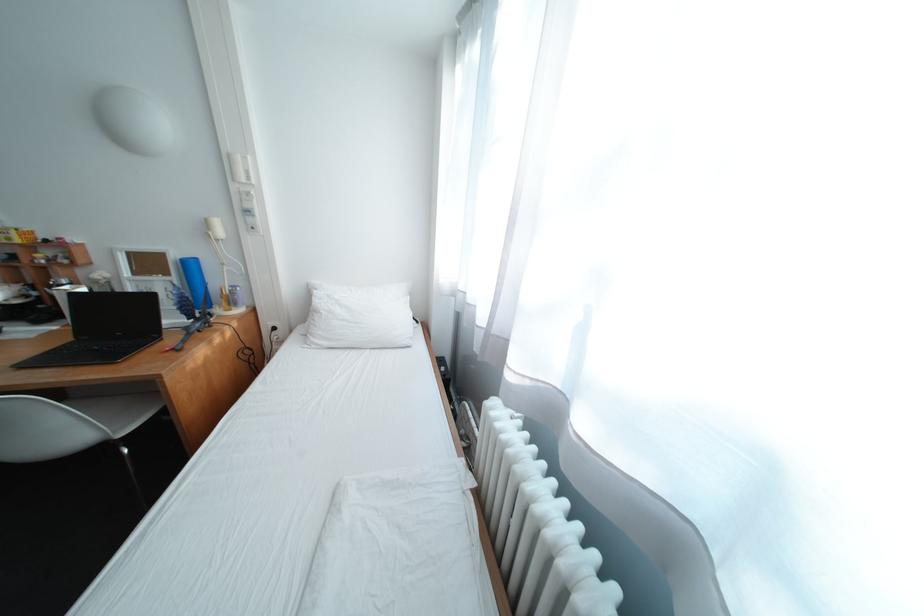
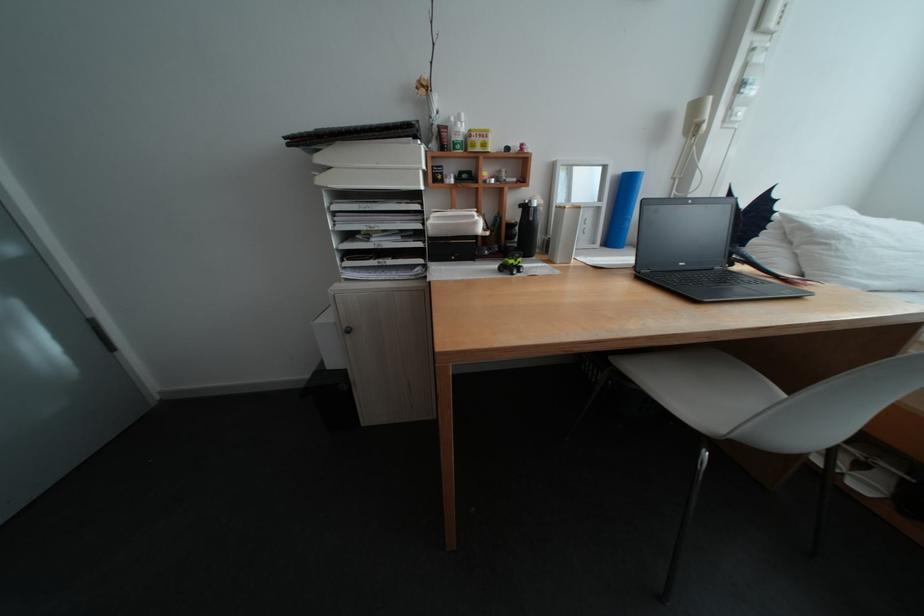
Question: What movement of the cameraman would produce the second image?

Choices:
 (A) Left
 (B) Right
 (C) Forward
 (D) Backward

Answer: (A)